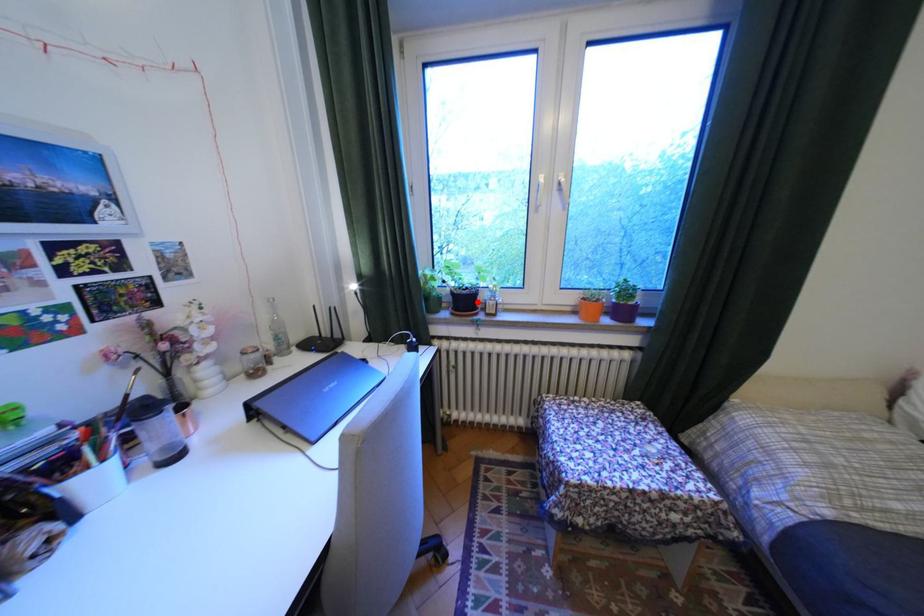
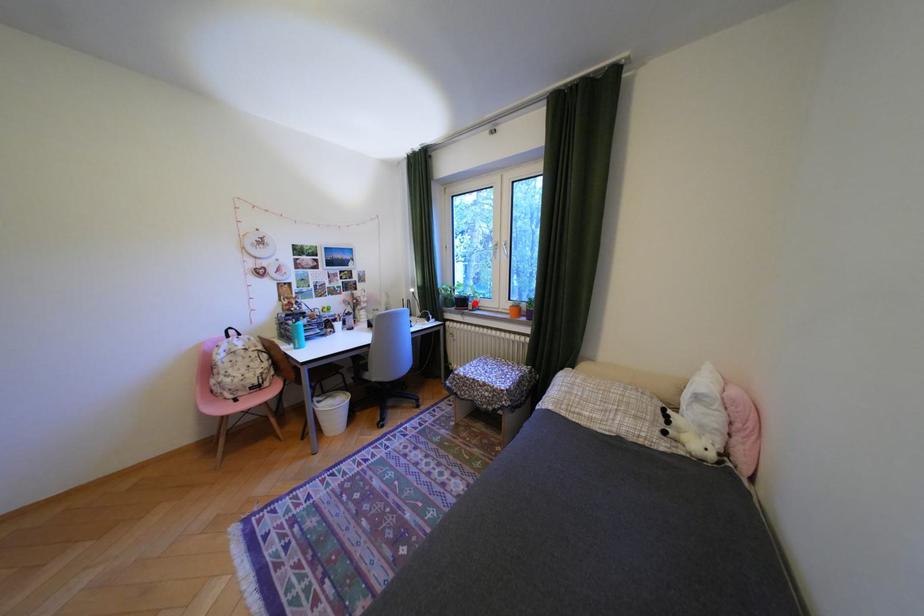
From the picture: I am providing you with two images of the same scene from different viewpoints. A red point is marked on the first image and another point is marked on the second image. Are the points marked in image1 and image2 representing the same 3D position?

Yes